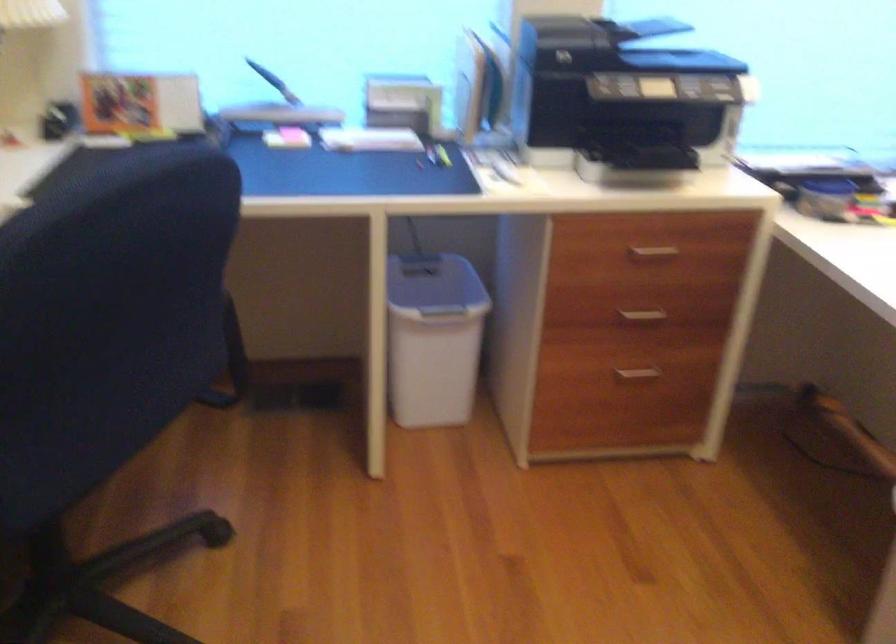
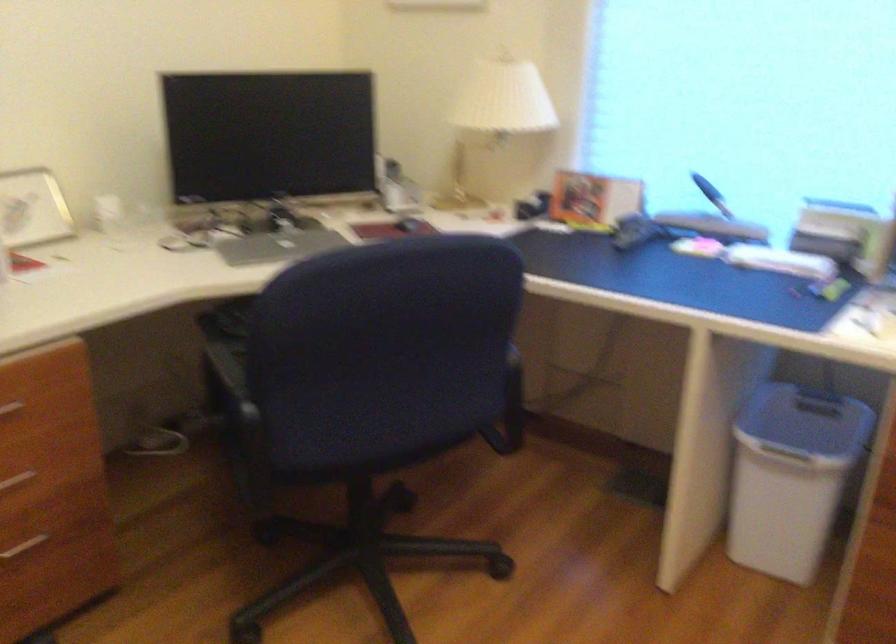
Question: The camera is either moving clockwise (left) or counter-clockwise (right) around the object. The first image is from the beginning of the video and the second image is from the end. Is the camera moving left or right when shooting the video?

Choices:
 (A) Left
 (B) Right

Answer: (B)